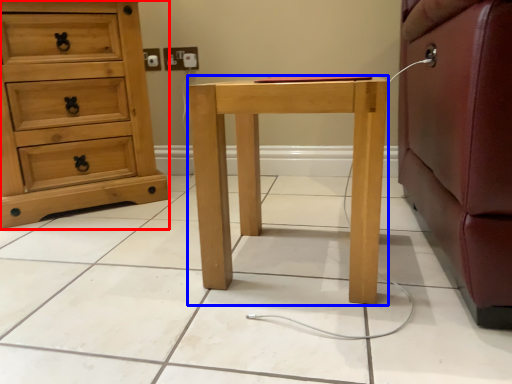
Question: Which object appears closest to the camera in this image, chest of drawers (highlighted by a red box) or nightstand (highlighted by a blue box)?

Choices:
 (A) chest of drawers
 (B) nightstand

Answer: (B)